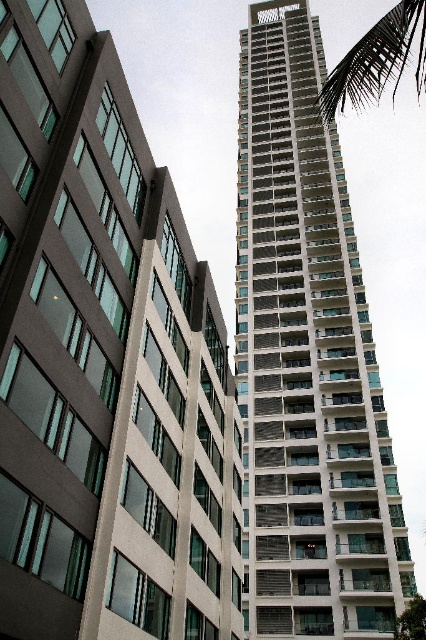
You are standing in front of the two buildings in the image. You notice two points marked in the scene. The first point is at coordinates point (310,188) and the second is at point (399,76). Which of these points appears closer to you?

Point (310,188) is closer to the camera than point (399,76), so the first point appears closer to you.

You are an architect evaluating the urban layout. Based on the scene, which object occupies a larger area in the image? Please consider the white glass building at center and the green leafy palm tree at upper right in your analysis.

The green leafy palm tree at upper right occupies a larger area in the image than the white glass building at center, as stated in the description.